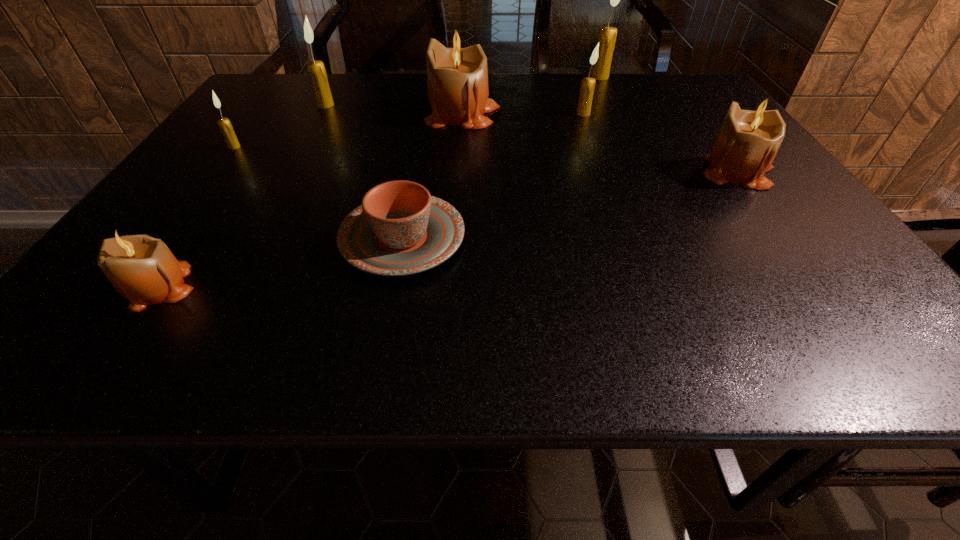
You are a GUI agent. You are given a task and a screenshot of the screen. Output one action in this format:
    pyautogui.click(x=<x>, y=<y>)
    Task: Click on the vacant space located 0.240m on the left of the rightmost beige candle
    This screenshot has height=540, width=960.
    Given the screenshot: What is the action you would take?
    pyautogui.click(x=592, y=172)

Identify the location of vacant space located 0.300m on the right of the smallest cream candle. (366, 147).

Locate an element on the screen. vacant space situated 0.380m on the back of the smallest beige candle is located at coordinates (252, 150).

Locate an element on the screen. This screenshot has width=960, height=540. blank space located on the handle side of the pink chinaware is located at coordinates coord(426,112).

What are the coordinates of `free space located on the handle side of the pink chinaware` in the screenshot? It's located at (424, 122).

Find the location of `free space located 0.330m on the handle side of the pink chinaware`. free space located 0.330m on the handle side of the pink chinaware is located at coordinates (423, 124).

The image size is (960, 540). Identify the location of object that is at the near edge. (142, 269).

You are a GUI agent. You are given a task and a screenshot of the screen. Output one action in this format:
    pyautogui.click(x=<x>, y=<y>)
    Task: Click on the object present at the right edge
    This screenshot has width=960, height=540.
    Given the screenshot: What is the action you would take?
    pyautogui.click(x=748, y=140)

The width and height of the screenshot is (960, 540). Identify the location of object present at the near left corner. (142, 269).

Image resolution: width=960 pixels, height=540 pixels. What are the coordinates of `free region at the far edge` in the screenshot? It's located at (650, 105).